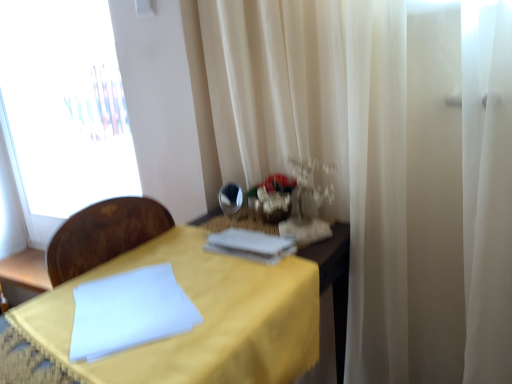
This screenshot has height=384, width=512. Identify the location of free space on the front side of shiny silver mirror at center. (226, 229).